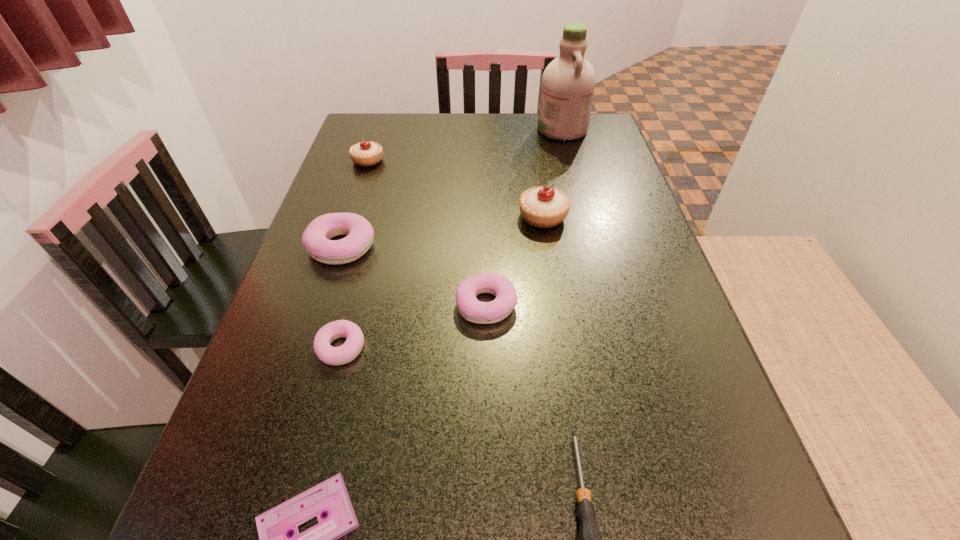
Find the location of `vacant area between the tallest object and the sixth shortest object`. vacant area between the tallest object and the sixth shortest object is located at coordinates (465, 145).

Locate an element on the screen. free space between the second tallest pastry and the farthest pink pastry is located at coordinates (355, 204).

The height and width of the screenshot is (540, 960). I want to click on vacant space that is in between the smaller beige pastry and the tallest pastry, so click(455, 188).

Identify the location of free space between the rightmost pastry and the farthest pastry. The width and height of the screenshot is (960, 540). (455, 188).

Image resolution: width=960 pixels, height=540 pixels. Find the location of `vacant space in between the smallest pink pastry and the nearer beige pastry`. vacant space in between the smallest pink pastry and the nearer beige pastry is located at coordinates (442, 282).

Where is `object identified as the sixth closest to the screwdriver`? Image resolution: width=960 pixels, height=540 pixels. object identified as the sixth closest to the screwdriver is located at coordinates (366, 153).

This screenshot has height=540, width=960. In order to click on object that stands as the second closest to the tallest object in this screenshot , I will do `click(366, 153)`.

The image size is (960, 540). In order to click on the second closest pastry to the shortest object in this screenshot , I will do `click(473, 310)`.

Identify which pastry is the third nearest to the videotape. Please provide its 2D coordinates. Your answer should be formatted as a tuple, i.e. [(x, y)], where the tuple contains the x and y coordinates of a point satisfying the conditions above.

[(316, 238)]

The width and height of the screenshot is (960, 540). What are the coordinates of `pink pastry that is the closest to the smallest pink pastry` in the screenshot? It's located at tap(316, 238).